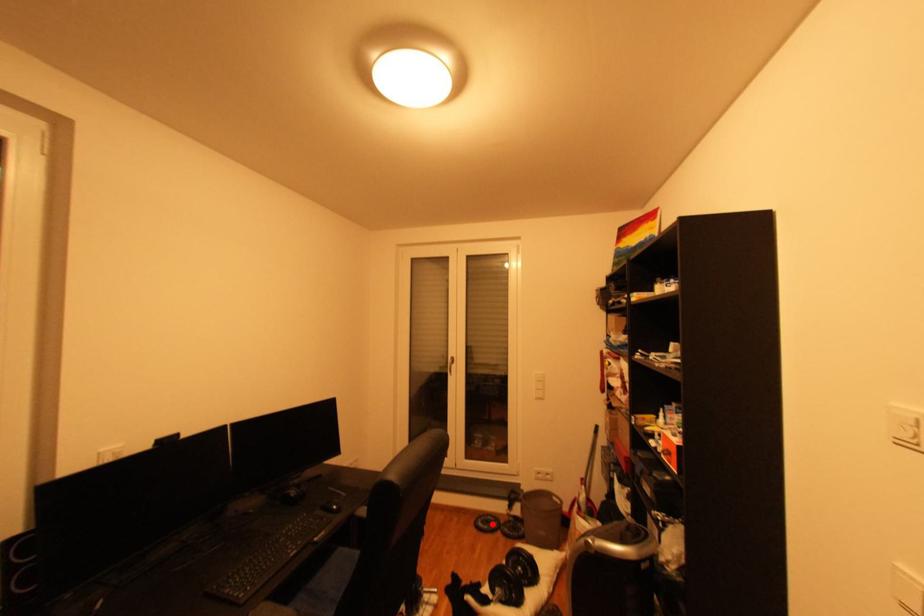
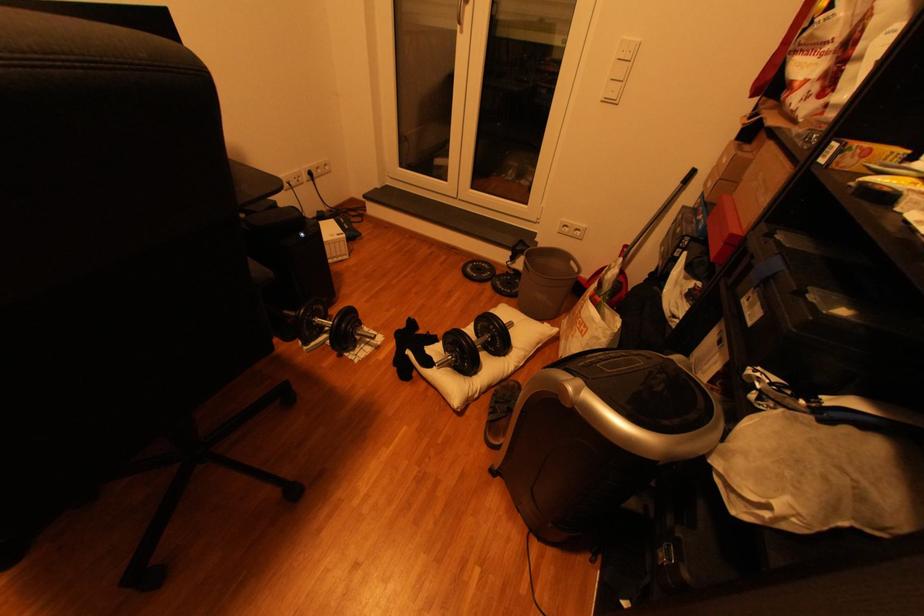
In the second image, find the point that corresponds to the highlighted location in the first image.

(482, 270)